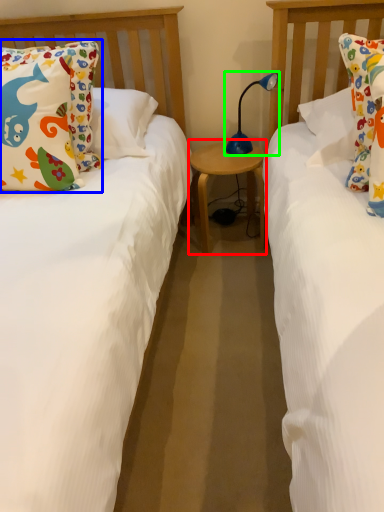
Question: Based on their relative distances, which object is farther from table (highlighted by a red box)? Choose from pillow (highlighted by a blue box) and table lamp (highlighted by a green box).

Choices:
 (A) pillow
 (B) table lamp

Answer: (A)